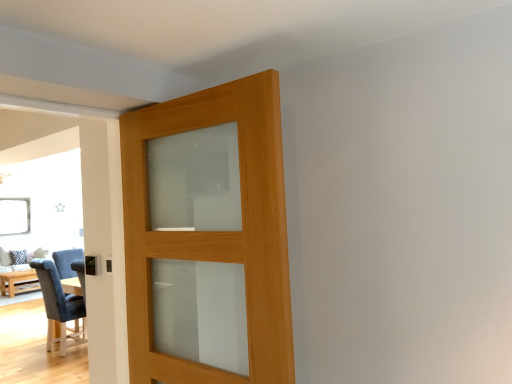
You are a GUI agent. You are given a task and a screenshot of the screen. Output one action in this format:
    pyautogui.click(x=<x>, y=<y>)
    Task: Click on the natural wood door at center
    The height and width of the screenshot is (384, 512).
    Given the screenshot: What is the action you would take?
    pyautogui.click(x=208, y=237)

What do you see at coordinates (208, 237) in the screenshot? The height and width of the screenshot is (384, 512). I see `natural wood door at center` at bounding box center [208, 237].

The width and height of the screenshot is (512, 384). What are the coordinates of `natural wood door at center` in the screenshot? It's located at (208, 237).